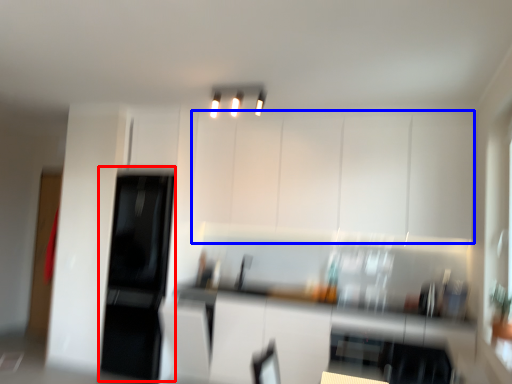
Question: Which point is further to the camera, appliance (highlighted by a red box) or cabinetry (highlighted by a blue box)?

Choices:
 (A) appliance
 (B) cabinetry

Answer: (A)